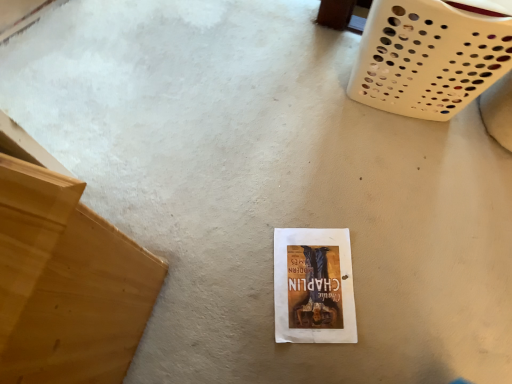
You are a GUI agent. You are given a task and a screenshot of the screen. Output one action in this format:
    pyautogui.click(x=<x>, y=<y>)
    Task: Click on the free space between light brown wood at left and white paper at center
    The image size is (512, 384).
    Given the screenshot: What is the action you would take?
    pyautogui.click(x=209, y=295)